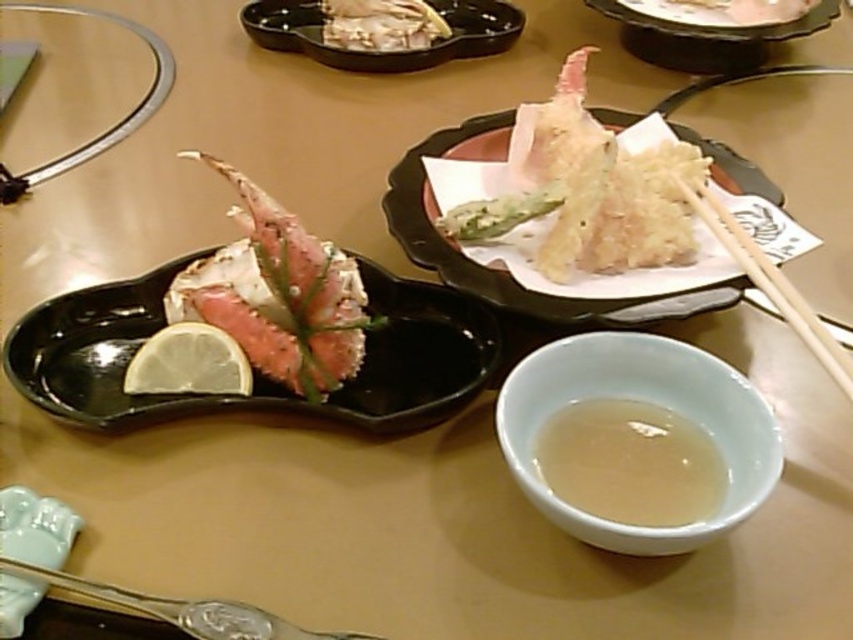
Is black glossy plate at center left positioned behind black glossy plate at upper center?

That is False.

Between black glossy plate at center left and black glossy plate at upper center, which one appears on the left side from the viewer's perspective?

black glossy plate at center left is more to the left.

This screenshot has height=640, width=853. Describe the element at coordinates (254, 369) in the screenshot. I see `black glossy plate at center left` at that location.

Locate an element on the screen. This screenshot has height=640, width=853. black glossy plate at center left is located at coordinates (254, 369).

Which is below, white paper plate at center or translucent liquid at center?

translucent liquid at center is below.

Consider the image. Who is more distant from viewer, (755, 177) or (717, 484)?

The point (755, 177) is more distant.

You are a GUI agent. You are given a task and a screenshot of the screen. Output one action in this format:
    pyautogui.click(x=<x>, y=<y>)
    Task: Click on the white paper plate at center
    This screenshot has height=640, width=853.
    Given the screenshot: What is the action you would take?
    pyautogui.click(x=503, y=269)

Describe the element at coordinates (283, 296) in the screenshot. I see `pink spiny crab at center` at that location.

Can you confirm if pink spiny crab at center is positioned to the left of shiny silver crab claw at center?

Indeed, pink spiny crab at center is positioned on the left side of shiny silver crab claw at center.

Is point (201, 157) less distant than point (379, 12)?

Yes, it is in front of point (379, 12).

Image resolution: width=853 pixels, height=640 pixels. Identify the location of pink spiny crab at center. (283, 296).